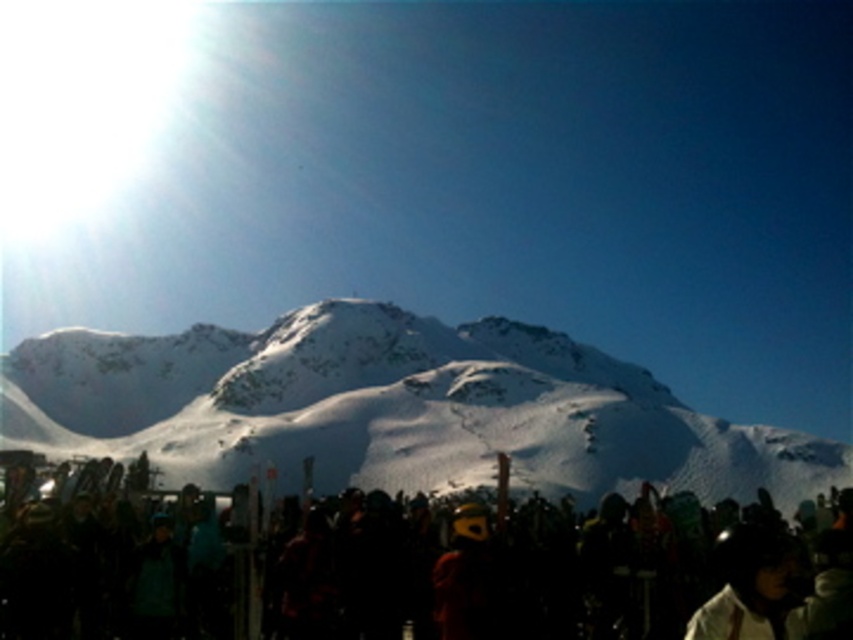
Question: Does white snow-covered mountain at center appear on the left side of black matte crowd at lower center?

Choices:
 (A) no
 (B) yes

Answer: (B)

Question: Which of the following is the closest to the observer?

Choices:
 (A) (454, 612)
 (B) (502, 333)

Answer: (A)

Question: Can you confirm if white snow-covered mountain at center is positioned to the right of black matte crowd at lower center?

Choices:
 (A) yes
 (B) no

Answer: (B)

Question: From the image, what is the correct spatial relationship of white snow-covered mountain at center in relation to black matte crowd at lower center?

Choices:
 (A) below
 (B) above

Answer: (B)